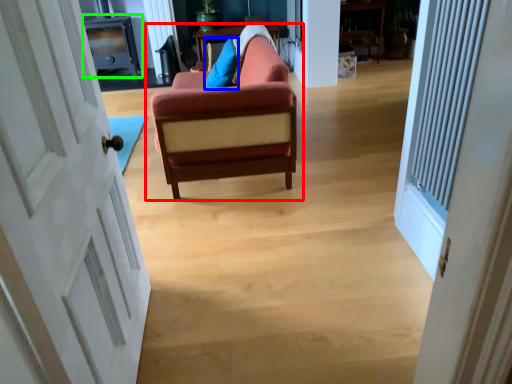
Question: Considering the real-world distances, which object is farthest from studio couch (highlighted by a red box)? pillow (highlighted by a blue box) or entertainment center (highlighted by a green box)?

Choices:
 (A) pillow
 (B) entertainment center

Answer: (B)